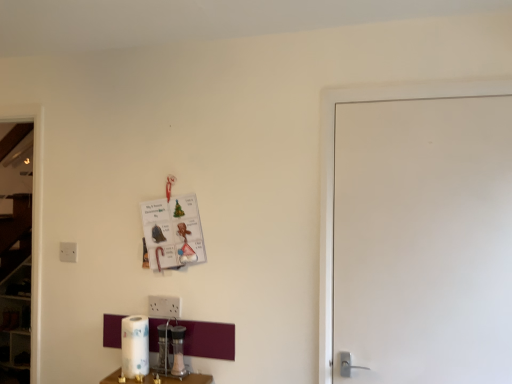
Question: Is metallic silver salt shaker at lower center touching white glossy paper towel at lower center?

Choices:
 (A) no
 (B) yes

Answer: (A)

Question: Is metallic silver salt shaker at lower center surrounding white glossy paper towel at lower center?

Choices:
 (A) yes
 (B) no

Answer: (B)

Question: Can you confirm if metallic silver salt shaker at lower center is wider than white glossy paper towel at lower center?

Choices:
 (A) no
 (B) yes

Answer: (B)

Question: Is metallic silver salt shaker at lower center at the left side of white glossy paper towel at lower center?

Choices:
 (A) no
 (B) yes

Answer: (A)

Question: Can you confirm if metallic silver salt shaker at lower center is shorter than white glossy paper towel at lower center?

Choices:
 (A) no
 (B) yes

Answer: (B)

Question: Does metallic silver salt shaker at lower center have a larger size compared to white glossy paper towel at lower center?

Choices:
 (A) no
 (B) yes

Answer: (A)

Question: From the image's perspective, is white matte door at right beneath white glossy paper towel at lower center?

Choices:
 (A) yes
 (B) no

Answer: (B)

Question: Is white matte door at right aimed at white glossy paper towel at lower center?

Choices:
 (A) yes
 (B) no

Answer: (B)

Question: Is white matte door at right to the right of white glossy paper towel at lower center from the viewer's perspective?

Choices:
 (A) no
 (B) yes

Answer: (B)

Question: From the image's perspective, does white matte door at right appear higher than white glossy paper towel at lower center?

Choices:
 (A) yes
 (B) no

Answer: (A)

Question: Can you confirm if white matte door at right is smaller than white glossy paper towel at lower center?

Choices:
 (A) no
 (B) yes

Answer: (A)

Question: Is white matte door at right not near white glossy paper towel at lower center?

Choices:
 (A) yes
 (B) no

Answer: (A)

Question: Is white matte door at right turned away from metallic silver salt shaker at lower center?

Choices:
 (A) no
 (B) yes

Answer: (A)